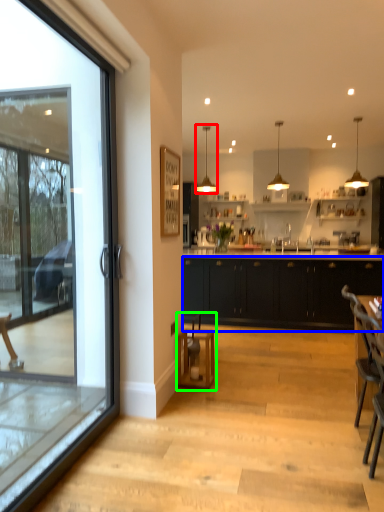
Question: Considering the real-world distances, which object is closest to lamp (highlighted by a red box)? cabinetry (highlighted by a blue box) or bar stool (highlighted by a green box).

Choices:
 (A) cabinetry
 (B) bar stool

Answer: (A)